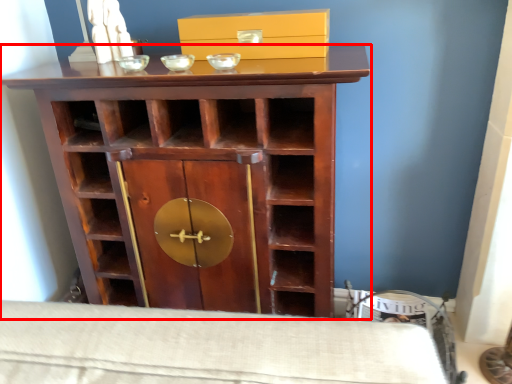
Question: Observing the image, what is the correct spatial positioning of cupboard (annotated by the red box) in reference to box?

Choices:
 (A) left
 (B) right

Answer: (A)